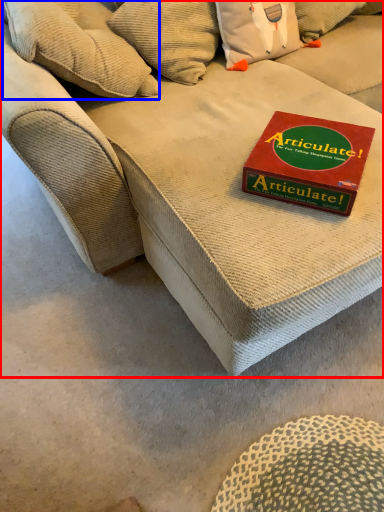
Question: Which point is further to the camera, studio couch (highlighted by a red box) or pillow (highlighted by a blue box)?

Choices:
 (A) studio couch
 (B) pillow

Answer: (B)